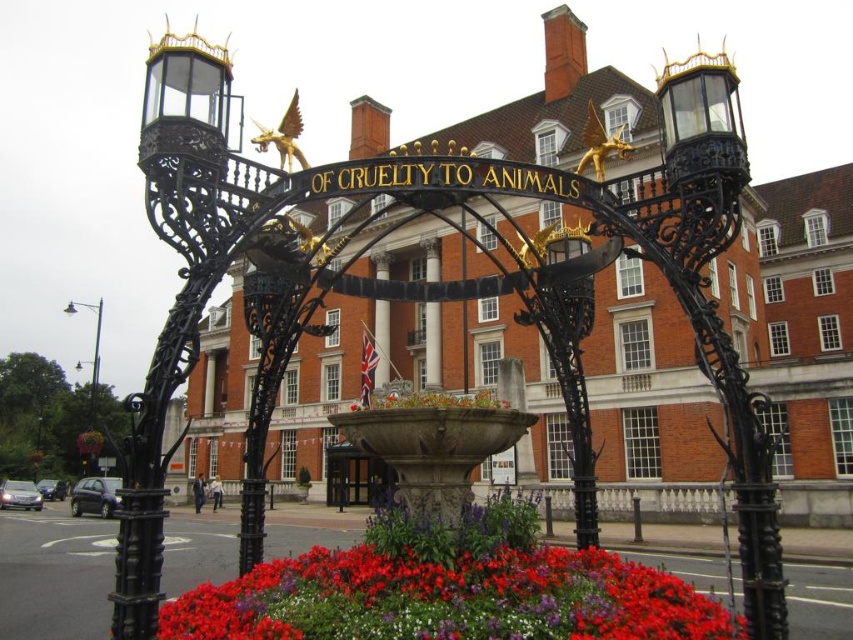
Question: Which object appears farthest from the camera in this image?

Choices:
 (A) green matte flower at lower left
 (B) floral bouquet at center
 (C) stone fountain at center

Answer: (A)

Question: Is vivid red petals at center positioned at the back of floral bouquet at center?

Choices:
 (A) yes
 (B) no

Answer: (B)

Question: Is metallic pole at left thinner than green matte flower at lower left?

Choices:
 (A) no
 (B) yes

Answer: (A)

Question: Can you confirm if metallic pole at left is smaller than green matte flower at lower left?

Choices:
 (A) yes
 (B) no

Answer: (B)

Question: Which point is closer to the camera?

Choices:
 (A) stone fountain at center
 (B) vivid red petals at center
 (C) metallic pole at left

Answer: (B)

Question: Estimate the real-world distances between objects in this image. Which object is farther from the vivid red petals at center?

Choices:
 (A) metallic pole at left
 (B) stone fountain at center
 (C) green matte flower at lower left

Answer: (A)